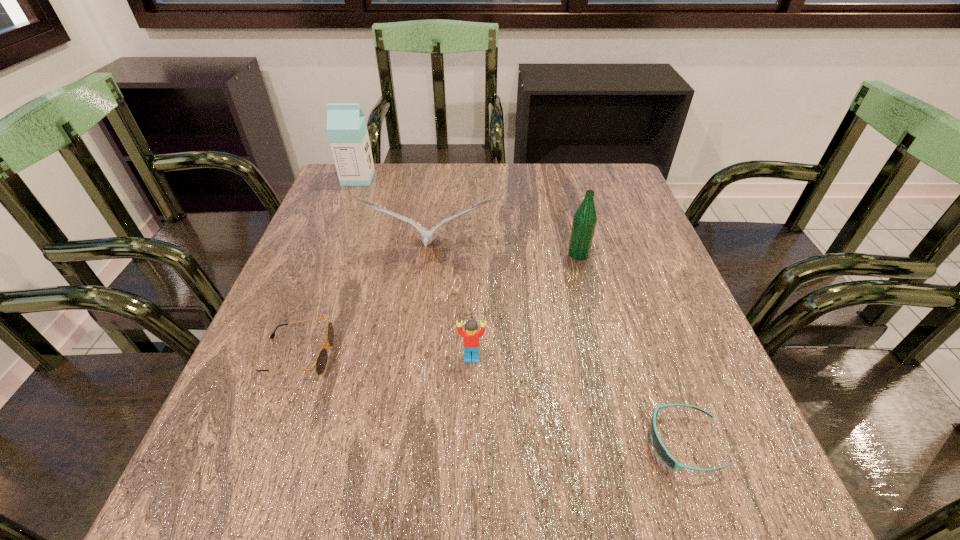
The height and width of the screenshot is (540, 960). I want to click on milk carton, so click(347, 129).

Image resolution: width=960 pixels, height=540 pixels. In order to click on the farthest object in this screenshot , I will do `click(347, 129)`.

Image resolution: width=960 pixels, height=540 pixels. Find the location of `bottle`. bottle is located at coordinates (584, 223).

Find the location of a particular element. Image resolution: width=960 pixels, height=540 pixels. gull is located at coordinates point(427,236).

Image resolution: width=960 pixels, height=540 pixels. In order to click on Lego in this screenshot , I will do `click(471, 334)`.

You are a GUI agent. You are given a task and a screenshot of the screen. Output one action in this format:
    pyautogui.click(x=<x>, y=<y>)
    Task: Click on the farther sunglasses
    
    Given the screenshot: What is the action you would take?
    pyautogui.click(x=321, y=361)

I want to click on the nearer sunglasses, so pos(658,446).

Locate an element on the screen. The width and height of the screenshot is (960, 540). the right sunglasses is located at coordinates (658, 446).

Find the location of a particular element. free region located 0.380m on the right of the farthest object is located at coordinates (502, 178).

You are a GUI agent. You are given a task and a screenshot of the screen. Output one action in this format:
    pyautogui.click(x=<x>, y=<y>)
    Task: Click on the vacant point located 0.060m on the front of the bottle
    This screenshot has width=960, height=540.
    Given the screenshot: What is the action you would take?
    pyautogui.click(x=585, y=279)